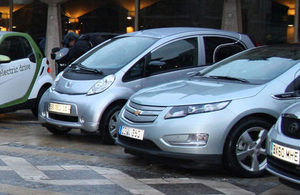
This screenshot has height=195, width=300. I want to click on window, so [12, 49], [173, 59], [253, 68], [117, 49].